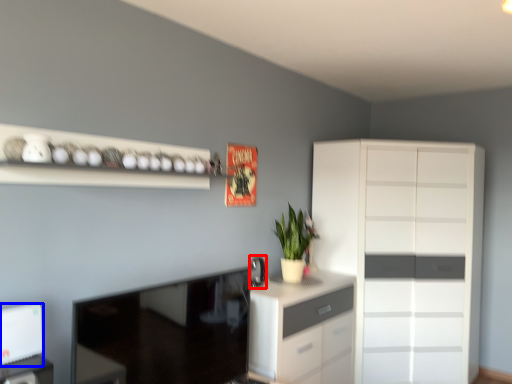
Question: Which object is further to the camera taking this photo, appliance (highlighted by a red box) or appliance (highlighted by a blue box)?

Choices:
 (A) appliance
 (B) appliance

Answer: (A)